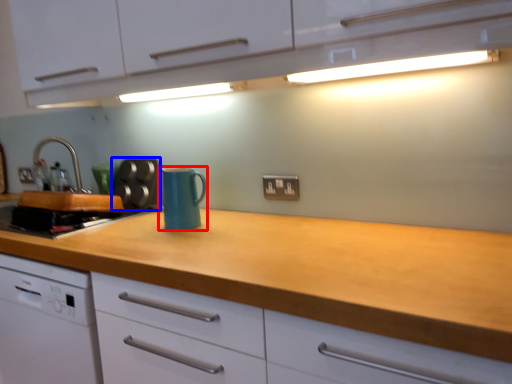
Question: Which object is further to the camera taking this photo, kitchen appliance (highlighted by a red box) or appliance (highlighted by a blue box)?

Choices:
 (A) kitchen appliance
 (B) appliance

Answer: (B)